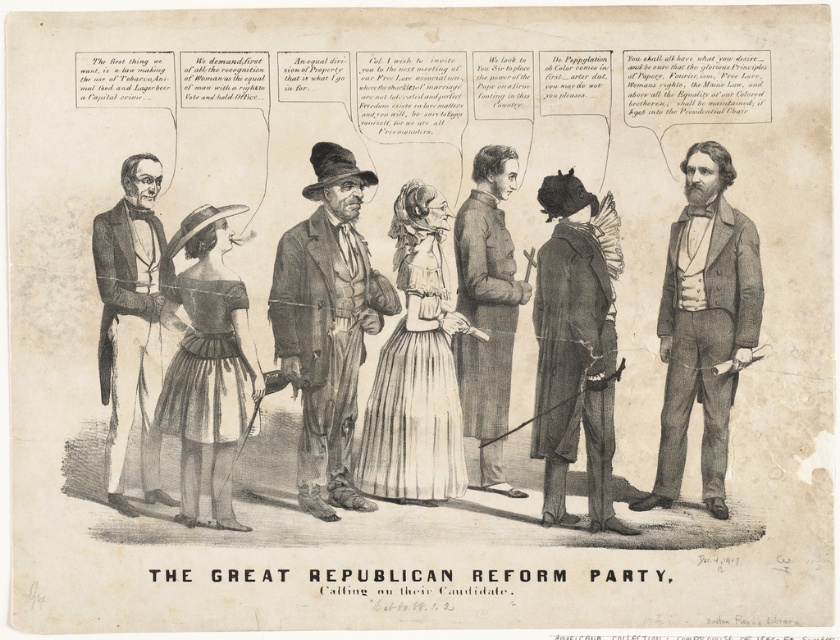
In the historical political cartoon, there is a figure wearing a smooth black suit at left. Where exactly is this figure positioned in the image?

The smooth black suit at left is positioned at point coordinates of 0.509 on the x axis and 0.157 on the y axis.

Based on the photo, you are an art conservator examining the historical political cartoon. You notice two points of discoloration on the image. One is at point (375,276) and the other at point (153,156). Which point is closer to the viewer?

Point (375,276) is further to the viewer than point (153,156), so the latter is closer.

Based on the political cartoon, which figure is taller? The one wearing the ragged brown coat at center or the one in the smooth black suit at left?

The ragged brown coat at center is taller than the smooth black suit at left according to the description.